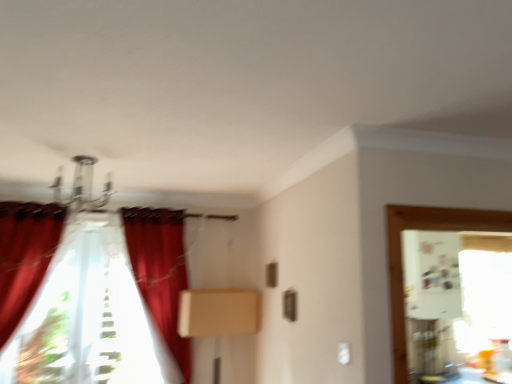
Image resolution: width=512 pixels, height=384 pixels. What do you see at coordinates (218, 312) in the screenshot?
I see `beige cardboard box at center` at bounding box center [218, 312].

I want to click on velvet red curtain at left, acting as the first curtain starting from the left, so click(25, 256).

The height and width of the screenshot is (384, 512). I want to click on velvet red curtain at center, which appears as the 3th curtain when viewed from the left, so click(160, 271).

Measure the distance between point (137, 225) and camera.

A distance of 3.19 meters exists between point (137, 225) and camera.

At what (x,y) coordinates should I click in order to perform the action: click on translucent fabric curtain at left, positioned as the second curtain in right-to-left order. Please return your answer as a coordinate pair (x, y). The height and width of the screenshot is (384, 512). Looking at the image, I should click on (160, 269).

I want to click on beige cardboard box at center, so pyautogui.click(x=218, y=312).

Which is closer, (156, 279) or (162, 319)?

Positioned in front is point (162, 319).

Is translucent fabric curtain at left, the second curtain positioned from the left, situated inside velvet red curtain at center, the 1th curtain in the right-to-left sequence, or outside?

translucent fabric curtain at left, the second curtain positioned from the left, is not enclosed by velvet red curtain at center, the 1th curtain in the right-to-left sequence.

Does translucent fabric curtain at left, positioned as the second curtain in right-to-left order, have a greater height compared to velvet red curtain at center, which appears as the 3th curtain when viewed from the left?

Incorrect, the height of translucent fabric curtain at left, positioned as the second curtain in right-to-left order, is not larger of that of velvet red curtain at center, which appears as the 3th curtain when viewed from the left.

Does velvet red curtain at center, which appears as the 3th curtain when viewed from the left, have a lesser width compared to beige cardboard box at center?

In fact, velvet red curtain at center, which appears as the 3th curtain when viewed from the left, might be wider than beige cardboard box at center.

How much distance is there between velvet red curtain at center, the 1th curtain in the right-to-left sequence, and beige cardboard box at center?

velvet red curtain at center, the 1th curtain in the right-to-left sequence, is 16.09 inches away from beige cardboard box at center.

Consider the image. Is velvet red curtain at center, which appears as the 3th curtain when viewed from the left, positioned behind beige cardboard box at center?

No, it is not.

Is velvet red curtain at center, which appears as the 3th curtain when viewed from the left, situated inside beige cardboard box at center or outside?

velvet red curtain at center, which appears as the 3th curtain when viewed from the left, is located beyond the bounds of beige cardboard box at center.

How many degrees apart are the facing directions of velvet red curtain at left, arranged as the 3th curtain when viewed from the right, and beige cardboard box at center?

velvet red curtain at left, arranged as the 3th curtain when viewed from the right, and beige cardboard box at center are facing 4.2 degrees away from each other.

Is beige cardboard box at center completely or partially inside velvet red curtain at left, acting as the first curtain starting from the left?

No.

From the image's perspective, is velvet red curtain at left, arranged as the 3th curtain when viewed from the right, above or below beige cardboard box at center?

Clearly, from the image's perspective, velvet red curtain at left, arranged as the 3th curtain when viewed from the right, is above beige cardboard box at center.

Considering the points (41, 247) and (240, 309), which point is behind, point (41, 247) or point (240, 309)?

The point (240, 309) is more distant.

Is beige cardboard box at center oriented towards velvet red curtain at center, which appears as the 3th curtain when viewed from the left?

No, beige cardboard box at center is not aimed at velvet red curtain at center, which appears as the 3th curtain when viewed from the left.

Can you confirm if beige cardboard box at center is shorter than velvet red curtain at center, which appears as the 3th curtain when viewed from the left?

Yes, beige cardboard box at center is shorter than velvet red curtain at center, which appears as the 3th curtain when viewed from the left.

From a real-world perspective, which object rests below the other?

beige cardboard box at center, from a real-world perspective.

From the image's perspective, does beige cardboard box at center appear higher than velvet red curtain at center, which appears as the 3th curtain when viewed from the left?

No, from the image's perspective, beige cardboard box at center is not above velvet red curtain at center, which appears as the 3th curtain when viewed from the left.

Is metallic chandelier at upper center oriented away from beige cardboard box at center?

That's not correct — metallic chandelier at upper center is not looking away from beige cardboard box at center.

Which of these two, metallic chandelier at upper center or beige cardboard box at center, stands shorter?

metallic chandelier at upper center is shorter.

From a real-world perspective, is metallic chandelier at upper center over beige cardboard box at center?

Yes, from a real-world perspective, metallic chandelier at upper center is over beige cardboard box at center

Based on their positions, is metallic chandelier at upper center located to the left or right of beige cardboard box at center?

Based on their positions, metallic chandelier at upper center is located to the left of beige cardboard box at center.

Is velvet red curtain at left, acting as the first curtain starting from the left, taller than velvet red curtain at center, which appears as the 3th curtain when viewed from the left?

Incorrect, the height of velvet red curtain at left, acting as the first curtain starting from the left, is not larger of that of velvet red curtain at center, which appears as the 3th curtain when viewed from the left.

The height and width of the screenshot is (384, 512). Find the location of `curtain that is the 1st one below the velvet red curtain at left, acting as the first curtain starting from the left (from a real-world perspective)`. curtain that is the 1st one below the velvet red curtain at left, acting as the first curtain starting from the left (from a real-world perspective) is located at coordinates (160, 271).

Can you confirm if velvet red curtain at left, acting as the first curtain starting from the left, is positioned to the right of velvet red curtain at center, which appears as the 3th curtain when viewed from the left?

In fact, velvet red curtain at left, acting as the first curtain starting from the left, is to the left of velvet red curtain at center, which appears as the 3th curtain when viewed from the left.

From a real-world perspective, which object stands above the other?

metallic chandelier at upper center, from a real-world perspective.

How distant is metallic chandelier at upper center from translucent fabric curtain at left, the second curtain positioned from the left?

22.97 inches.

Consider the image. Between metallic chandelier at upper center and translucent fabric curtain at left, the second curtain positioned from the left, which one has smaller width?

Thinner between the two is translucent fabric curtain at left, the second curtain positioned from the left.

Locate an element on the screen. This screenshot has height=384, width=512. light fixture above the translucent fabric curtain at left, the second curtain positioned from the left (from the image's perspective) is located at coordinates (82, 186).

Find the location of a particular element. Image resolution: width=512 pixels, height=384 pixels. curtain below the velvet red curtain at center, the 1th curtain in the right-to-left sequence (from a real-world perspective) is located at coordinates pyautogui.click(x=160, y=269).

There is a beige cardboard box at center. At what (x,y) coordinates should I click in order to perform the action: click on the 2nd curtain above it (from a real-world perspective). Please return your answer as a coordinate pair (x, y). Looking at the image, I should click on (160, 271).

Looking at the image, which one is located closer to translucent fabric curtain at left, positioned as the second curtain in right-to-left order, beige cardboard box at center or velvet red curtain at left, arranged as the 3th curtain when viewed from the right?

beige cardboard box at center lies closer to translucent fabric curtain at left, positioned as the second curtain in right-to-left order, than the other object.

Based on their spatial positions, is translucent fabric curtain at left, the second curtain positioned from the left, or metallic chandelier at upper center closer to beige cardboard box at center?

Among the two, translucent fabric curtain at left, the second curtain positioned from the left, is located nearer to beige cardboard box at center.

Estimate the real-world distances between objects in this image. Which object is further from beige cardboard box at center, velvet red curtain at center, which appears as the 3th curtain when viewed from the left, or translucent fabric curtain at left, positioned as the second curtain in right-to-left order?

velvet red curtain at center, which appears as the 3th curtain when viewed from the left, is further to beige cardboard box at center.

Looking at this image, looking at the image, which one is located further to beige cardboard box at center, metallic chandelier at upper center or translucent fabric curtain at left, the second curtain positioned from the left?

The object further to beige cardboard box at center is metallic chandelier at upper center.

Considering their positions, is translucent fabric curtain at left, positioned as the second curtain in right-to-left order, positioned further to velvet red curtain at left, arranged as the 3th curtain when viewed from the right, than metallic chandelier at upper center?

The object further to velvet red curtain at left, arranged as the 3th curtain when viewed from the right, is translucent fabric curtain at left, positioned as the second curtain in right-to-left order.

From the image, which object appears to be farther from velvet red curtain at left, acting as the first curtain starting from the left, metallic chandelier at upper center or velvet red curtain at center, the 1th curtain in the right-to-left sequence?

velvet red curtain at center, the 1th curtain in the right-to-left sequence, is positioned further to the anchor velvet red curtain at left, acting as the first curtain starting from the left.

When comparing their distances from velvet red curtain at center, which appears as the 3th curtain when viewed from the left, does velvet red curtain at left, acting as the first curtain starting from the left, or metallic chandelier at upper center seem closer?

Among the two, metallic chandelier at upper center is located nearer to velvet red curtain at center, which appears as the 3th curtain when viewed from the left.

Looking at the image, which one is located closer to velvet red curtain at center, the 1th curtain in the right-to-left sequence, metallic chandelier at upper center or translucent fabric curtain at left, positioned as the second curtain in right-to-left order?

translucent fabric curtain at left, positioned as the second curtain in right-to-left order, lies closer to velvet red curtain at center, the 1th curtain in the right-to-left sequence, than the other object.

Where is `light fixture between velvet red curtain at left, acting as the first curtain starting from the left, and beige cardboard box at center, in the horizontal direction`? light fixture between velvet red curtain at left, acting as the first curtain starting from the left, and beige cardboard box at center, in the horizontal direction is located at coordinates (82, 186).

I want to click on curtain between metallic chandelier at upper center and velvet red curtain at center, the 1th curtain in the right-to-left sequence, vertically, so click(x=25, y=256).

At what (x,y) coordinates should I click in order to perform the action: click on curtain located between velvet red curtain at left, arranged as the 3th curtain when viewed from the right, and velvet red curtain at center, which appears as the 3th curtain when viewed from the left, in the left-right direction. Please return your answer as a coordinate pair (x, y). Looking at the image, I should click on (160, 269).

Find the location of a particular element. curtain between translucent fabric curtain at left, the second curtain positioned from the left, and beige cardboard box at center is located at coordinates (160, 271).